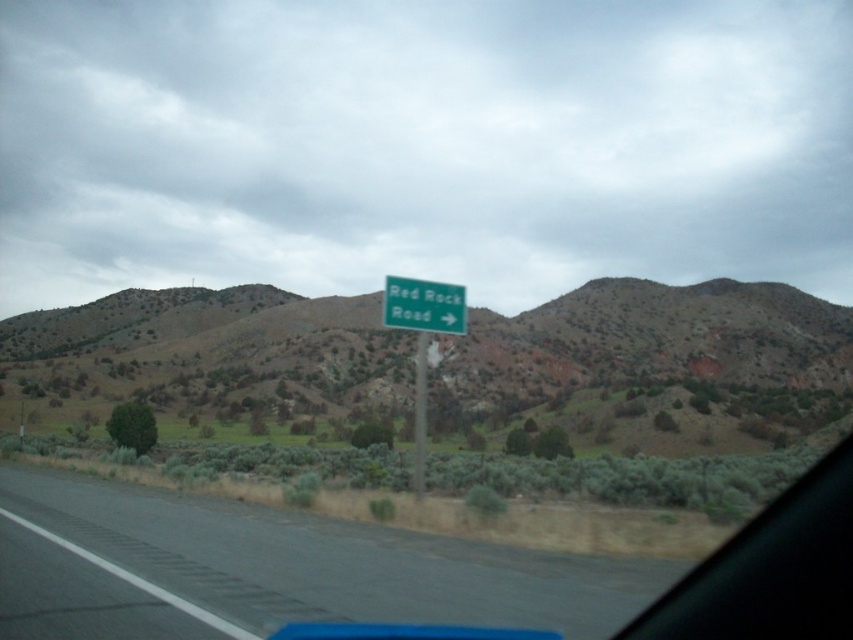
Is the position of gray asphalt road at center more distant than that of green metallic sign at center?

No, gray asphalt road at center is in front of green metallic sign at center.

Between point (315, 605) and point (445, 298), which one is positioned in front?

Positioned in front is point (315, 605).

The height and width of the screenshot is (640, 853). In order to click on gray asphalt road at center in this screenshot , I will do `click(329, 561)`.

Between green grassy hill at center and green metallic sign at center, which one appears on the left side from the viewer's perspective?

From the viewer's perspective, green metallic sign at center appears more on the left side.

Does green grassy hill at center appear over green metallic sign at center?

Incorrect, green grassy hill at center is not positioned above green metallic sign at center.

Is point (351, 339) closer to camera compared to point (457, 291)?

No, it is not.

You are a GUI agent. You are given a task and a screenshot of the screen. Output one action in this format:
    pyautogui.click(x=<x>, y=<y>)
    Task: Click on the green grassy hill at center
    
    Given the screenshot: What is the action you would take?
    tap(213, 346)

Identify the location of green grassy hill at center. This screenshot has width=853, height=640. click(213, 346).

Between point (579, 337) and point (422, 339), which one is positioned in front?

Positioned in front is point (422, 339).

Identify the location of green grassy hill at center. (213, 346).